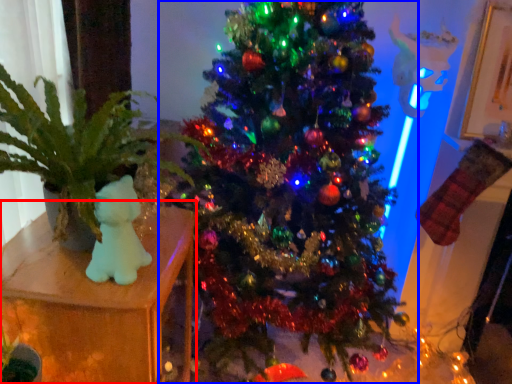
Question: Which of the following is the closest to the observer, furniture (highlighted by a red box) or christmas tree (highlighted by a blue box)?

Choices:
 (A) furniture
 (B) christmas tree

Answer: (B)